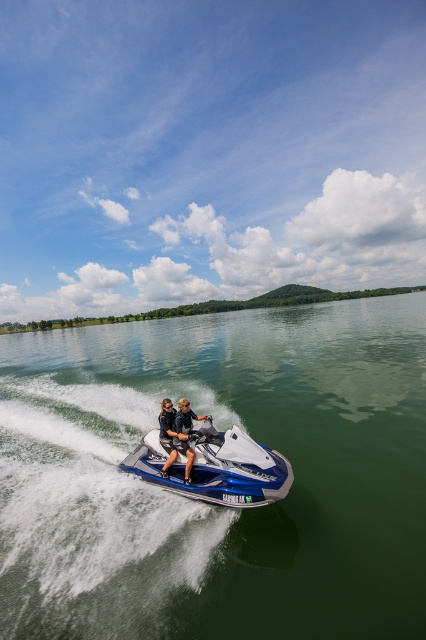
Which is below, blue metallic jet ski at center or black matte wetsuits at center?

blue metallic jet ski at center

Is blue metallic jet ski at center smaller than black matte wetsuits at center?

No.

I want to click on blue metallic jet ski at center, so (216, 467).

Is blue metallic water at center above black matte wetsuits at center?

Actually, blue metallic water at center is below black matte wetsuits at center.

Which is behind, point (112, 342) or point (184, 444)?

The point (112, 342) is more distant.

Is point (183, 337) positioned after point (176, 452)?

Yes.

Find the location of a particular element. blue metallic water at center is located at coordinates (215, 506).

Does blue metallic jet ski at center have a lesser height compared to black matte life vest at center?

Correct, blue metallic jet ski at center is not as tall as black matte life vest at center.

Locate an element on the screen. Image resolution: width=426 pixels, height=640 pixels. blue metallic jet ski at center is located at coordinates (216, 467).

Who is more distant from viewer, [144,474] or [166,464]?

The point [144,474] is behind.

Locate an element on the screen. This screenshot has height=640, width=426. blue metallic jet ski at center is located at coordinates (216, 467).